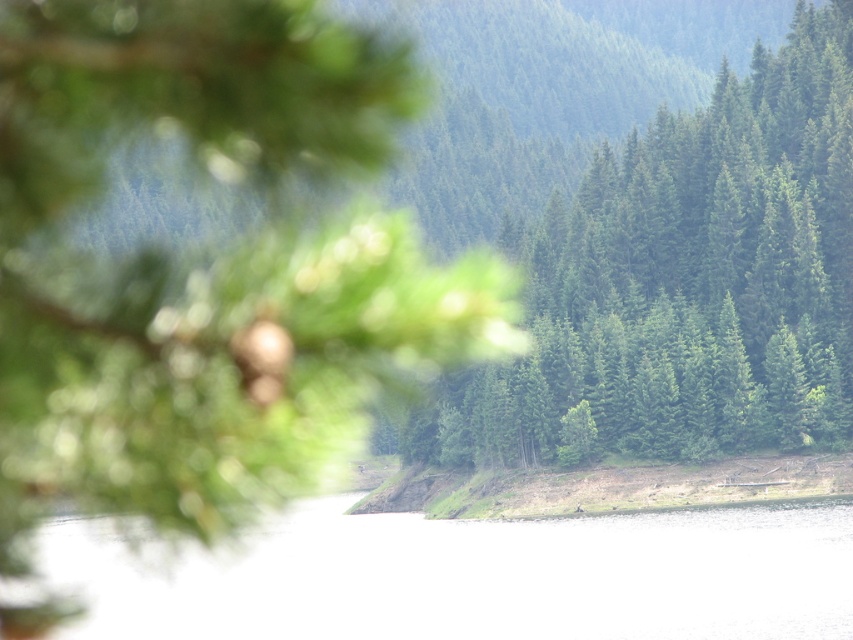
Can you confirm if green matte tree at center is smaller than clear water at center?

Incorrect, green matte tree at center is not smaller in size than clear water at center.

Who is taller, green matte tree at center or clear water at center?

green matte tree at center

This screenshot has width=853, height=640. What do you see at coordinates (683, 282) in the screenshot?
I see `green matte tree at center` at bounding box center [683, 282].

Where is `green matte tree at center`? green matte tree at center is located at coordinates (683, 282).